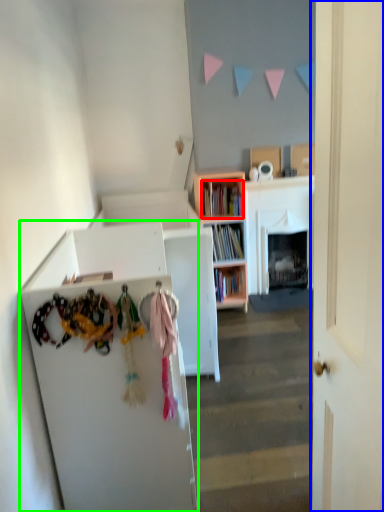
Question: Which object is the closest to the book (highlighted by a red box)? Choose among these: door (highlighted by a blue box) or cabinetry (highlighted by a green box).

Choices:
 (A) door
 (B) cabinetry

Answer: (B)